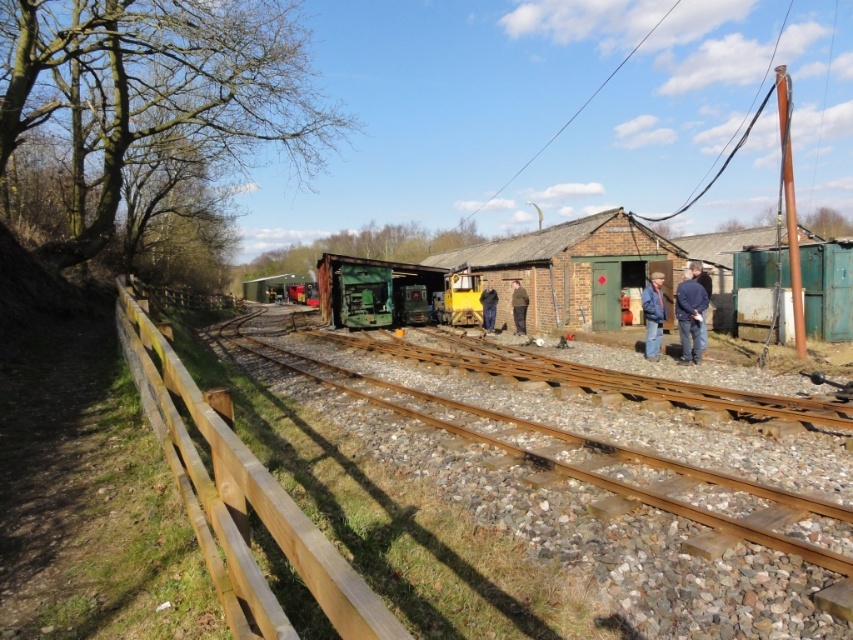
Question: Estimate the real-world distances between objects in this image. Which object is farther from the brown leather jacket at center?

Choices:
 (A) rusty green hut at right
 (B) blue denim jacket at center
 (C) blue denim jacket at right

Answer: (A)

Question: Does blue denim jacket at center have a lesser width compared to brown leather jacket at center?

Choices:
 (A) no
 (B) yes

Answer: (A)

Question: Does blue denim jacket at center appear on the right side of brown leather jacket at center?

Choices:
 (A) yes
 (B) no

Answer: (A)

Question: Does blue denim jacket at center have a greater width compared to dark blue jacket at center?

Choices:
 (A) yes
 (B) no

Answer: (B)

Question: Which point is closer to the camera?

Choices:
 (A) 469,440
 (B) 701,300
 (C) 708,241
 (D) 488,301

Answer: (A)

Question: Which object is closer to the camera taking this photo?

Choices:
 (A) brown brick hut at center
 (B) brown leather jacket at center
 (C) rusty metal train track at center
 (D) blue denim jacket at right

Answer: (C)